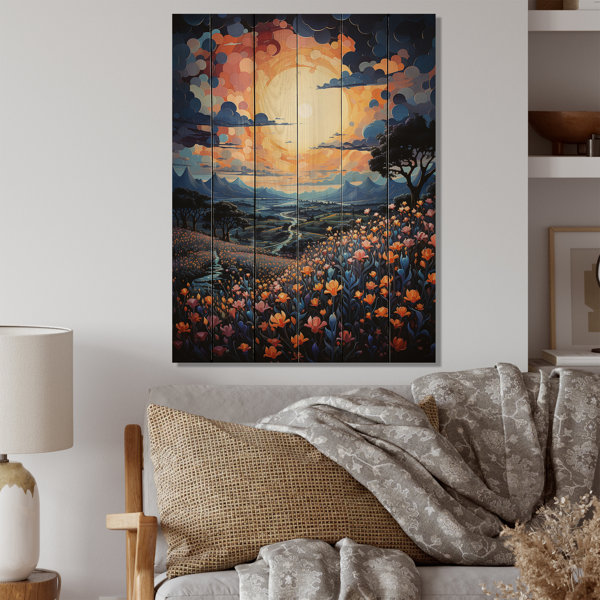
Find the location of a particular element. big brown pillow is located at coordinates (218, 465), (308, 489).